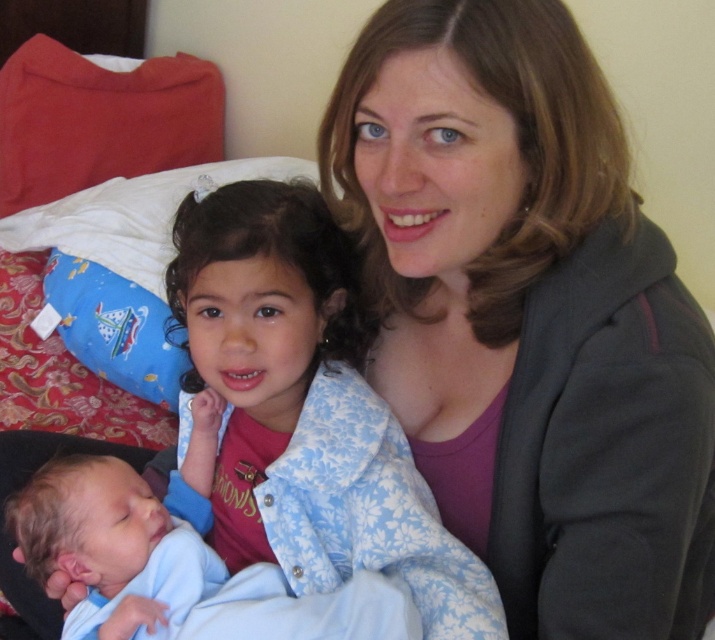
You are organizing a small display and want to place the matte gray hoodie at center and the red soft pillow at upper left next to each other. Which object should you place first to ensure they fit within the available space?

The matte gray hoodie at center should be placed first because it occupies less space than the red soft pillow at upper left, allowing more room for arrangement.